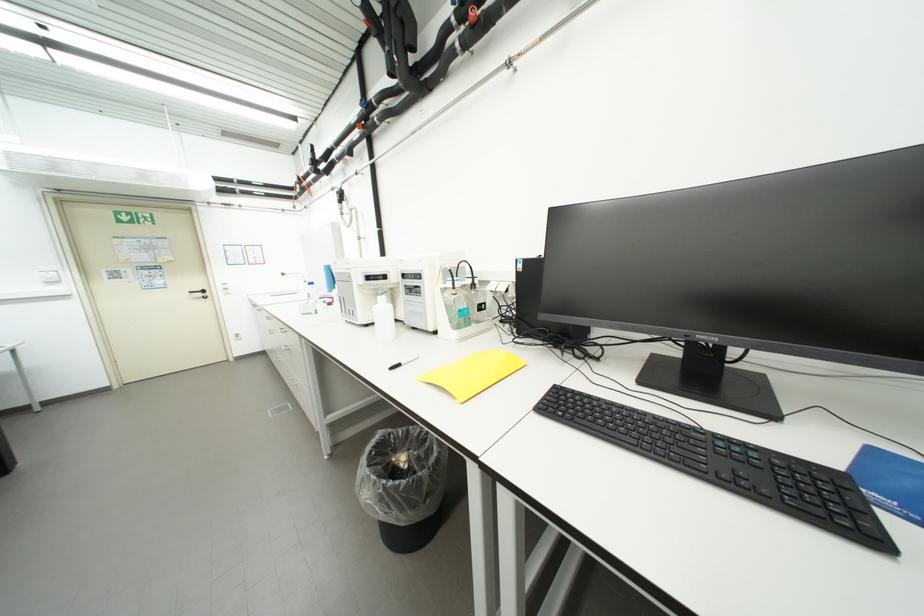
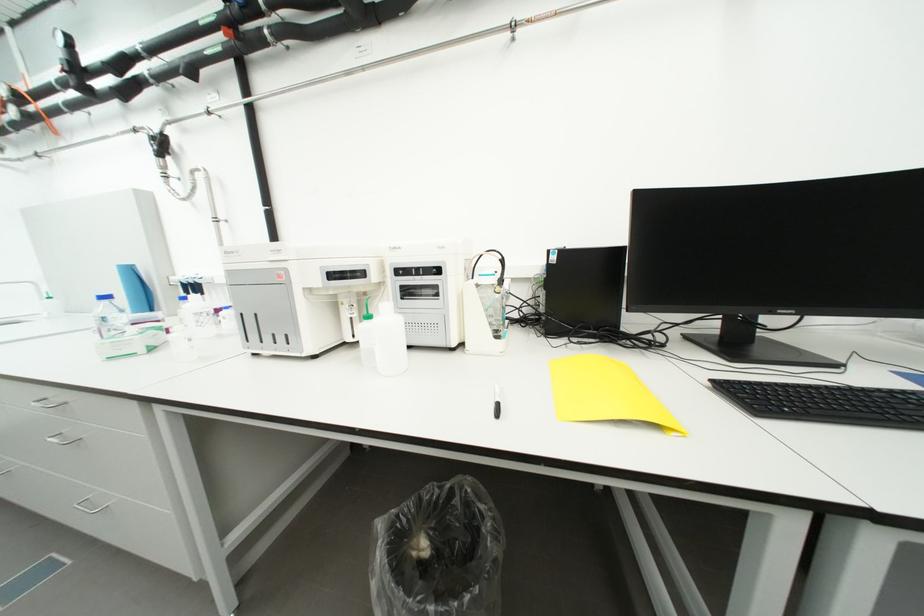
Find the pixel in the second image that matches (528,268) in the first image.

(562, 259)